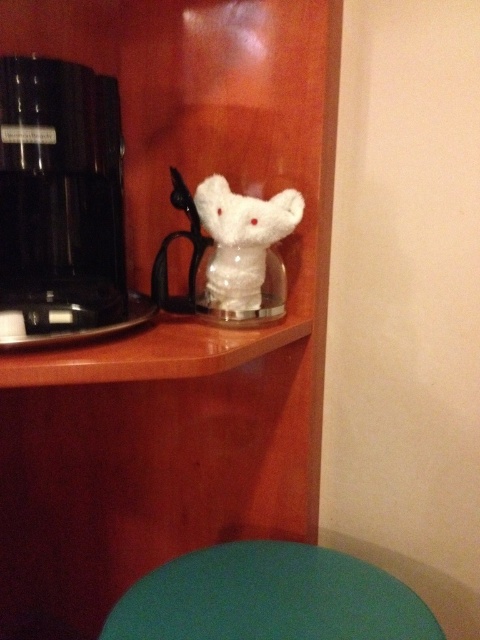
Question: Does black plastic coffee machine at left have a greater width compared to teal matte table at lower center?

Choices:
 (A) no
 (B) yes

Answer: (A)

Question: Can you confirm if white plush toy at center is thinner than black plastic coffee machine at left?

Choices:
 (A) yes
 (B) no

Answer: (B)

Question: Can you confirm if white plush toy at center is positioned to the left of teal matte table at lower center?

Choices:
 (A) no
 (B) yes

Answer: (B)

Question: Which of the following is the closest to the observer?

Choices:
 (A) (75, 324)
 (B) (396, 600)
 (C) (328, 152)
 (D) (216, 209)

Answer: (A)

Question: Which object appears closest to the camera in this image?

Choices:
 (A) teal matte table at lower center
 (B) black plastic coffee machine at left
 (C) white fluffy elephant at center
 (D) white plush toy at center

Answer: (D)

Question: Which point is closer to the camera taking this photo?

Choices:
 (A) (224, 268)
 (B) (25, 280)
 (C) (242, 125)

Answer: (B)